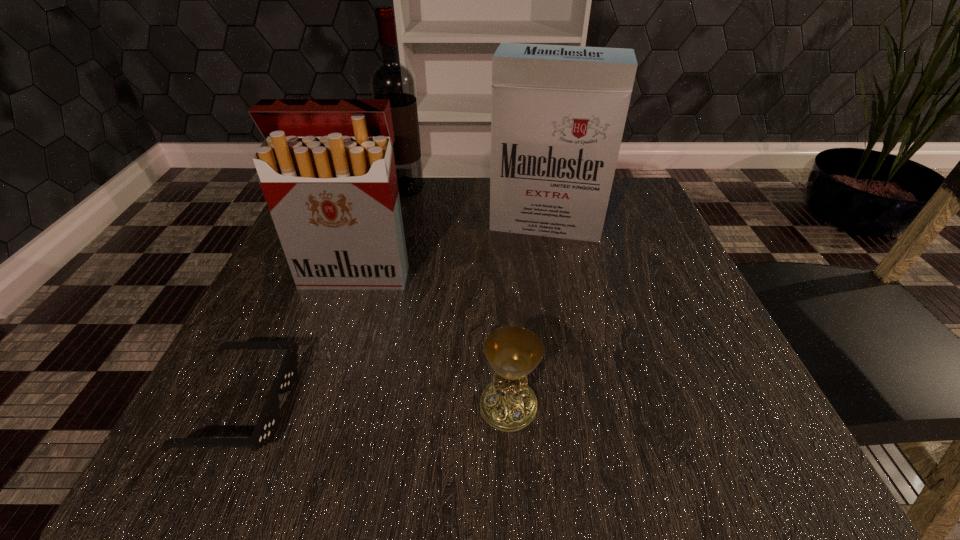
You are a GUI agent. You are given a task and a screenshot of the screen. Output one action in this format:
    pyautogui.click(x=<x>, y=<y>)
    Task: Click on the free spot between the farthest object and the farther cigarette case
    This screenshot has width=960, height=540.
    Given the screenshot: What is the action you would take?
    (x=475, y=207)

The height and width of the screenshot is (540, 960). I want to click on unoccupied area between the fourth tallest object and the wine bottle, so click(x=457, y=298).

Where is `free area in between the chalice and the shortest object`? free area in between the chalice and the shortest object is located at coordinates (375, 405).

Find the location of a particular element. The width and height of the screenshot is (960, 540). empty space that is in between the right cigarette case and the farthest object is located at coordinates (475, 207).

This screenshot has width=960, height=540. Find the location of `free space between the farthest object and the right cigarette case`. free space between the farthest object and the right cigarette case is located at coordinates (475, 207).

Identify the location of empty space that is in between the second farthest object and the shortest object. This screenshot has height=540, width=960. (394, 314).

This screenshot has width=960, height=540. Identify the location of free spot between the chalice and the shortest object. (375, 405).

This screenshot has width=960, height=540. Find the location of `the closest object relative to the farther cigarette case`. the closest object relative to the farther cigarette case is located at coordinates (391, 80).

The image size is (960, 540). I want to click on object that is the third closest to the third nearest object, so click(x=391, y=80).

I want to click on vacant space that satisfies the following two spatial constraints: 1. on the front side of the farthest object; 2. on the front-facing side of the sunglasses, so click(352, 404).